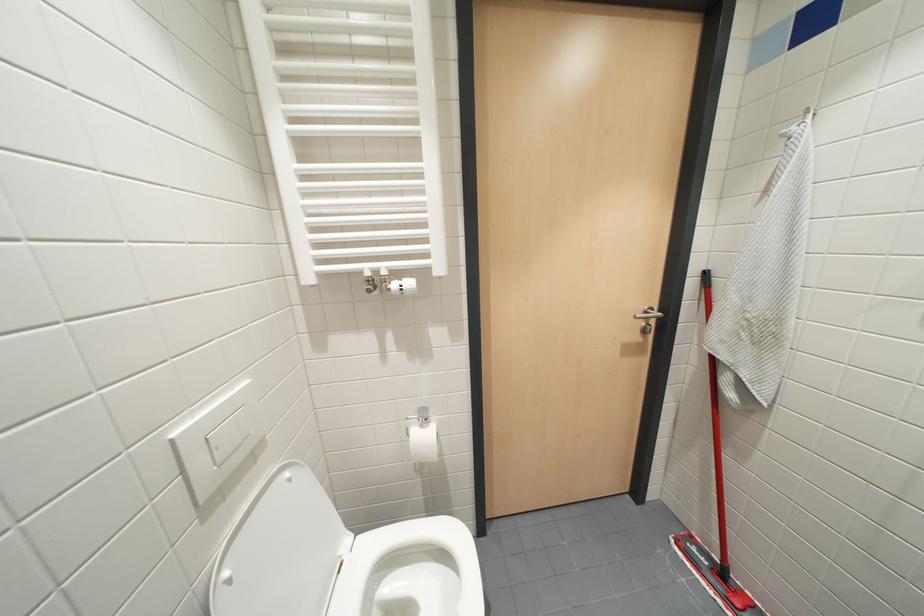
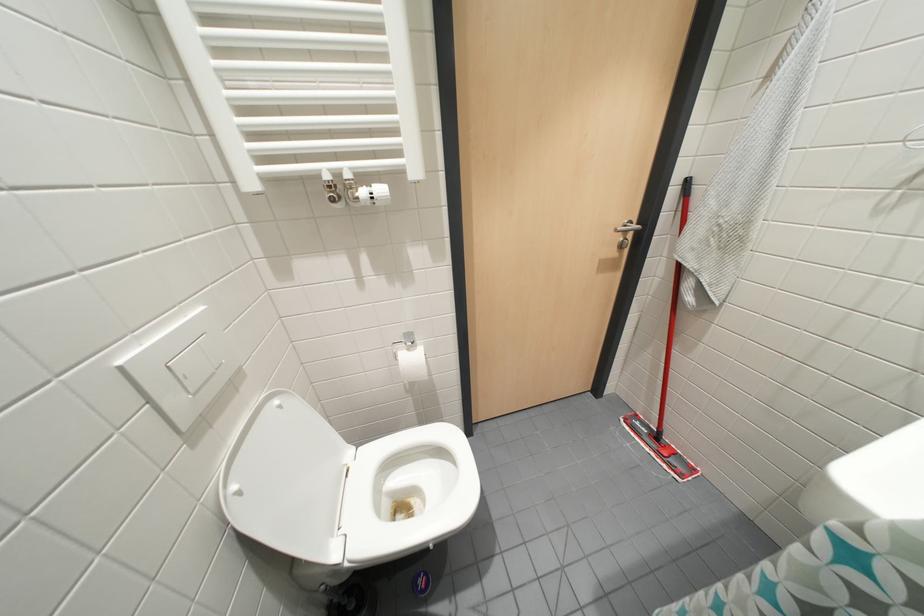
Question: The first image is from the beginning of the video and the second image is from the end. How did the camera likely rotate when shooting the video?

Choices:
 (A) Left
 (B) Right
 (C) Up
 (D) Down

Answer: (D)